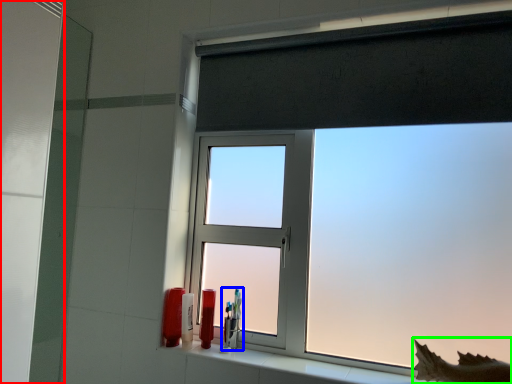
Question: Which object is positioned farthest from screen door (highlighted by a red box)? Select from toiletry (highlighted by a blue box) and animal (highlighted by a green box).

Choices:
 (A) toiletry
 (B) animal

Answer: (B)